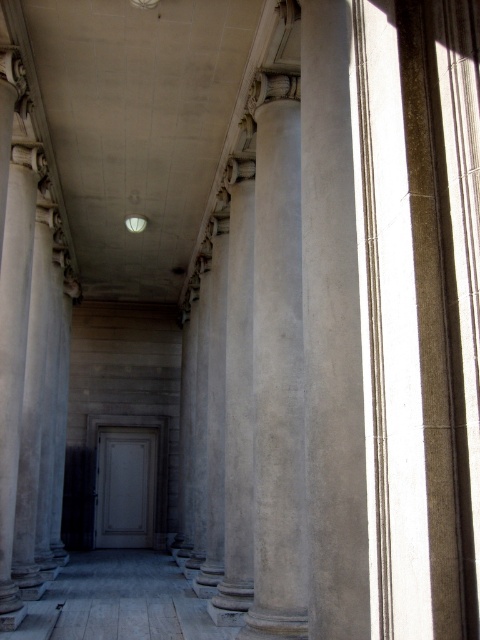
Question: Can you confirm if smooth concrete column at center is positioned to the left of white matte door at center?

Choices:
 (A) no
 (B) yes

Answer: (A)

Question: Which object is farther from the camera taking this photo?

Choices:
 (A) white matte door at center
 (B) smooth concrete column at center
 (C) gray stone column at center

Answer: (A)

Question: Is smooth concrete column at center thinner than white matte door at center?

Choices:
 (A) no
 (B) yes

Answer: (B)

Question: Considering the relative positions of smooth concrete column at center and white matte door at center in the image provided, where is smooth concrete column at center located with respect to white matte door at center?

Choices:
 (A) below
 (B) above

Answer: (B)

Question: Which point is closer to the camera?

Choices:
 (A) gray stone column at center
 (B) white matte door at center

Answer: (A)

Question: Among these points, which one is farthest from the camera?

Choices:
 (A) pyautogui.click(x=339, y=632)
 (B) pyautogui.click(x=106, y=467)

Answer: (B)